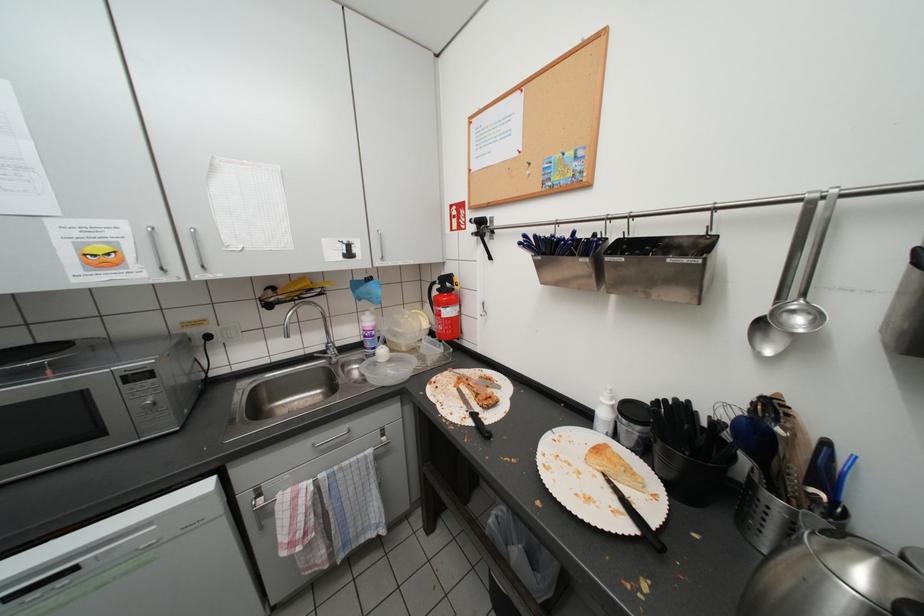
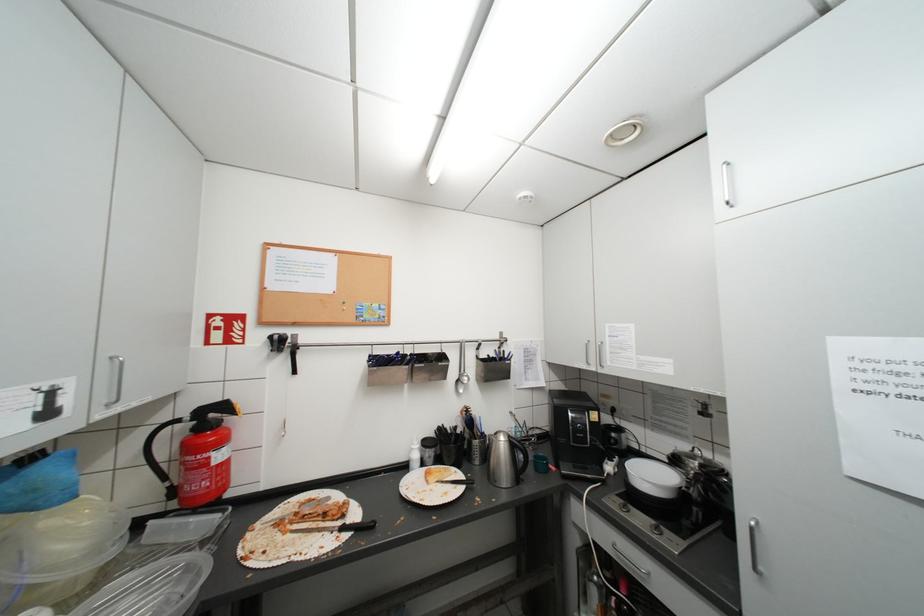
Question: How did the camera likely rotate?

Choices:
 (A) Left
 (B) Right
 (C) Up
 (D) Down

Answer: (B)